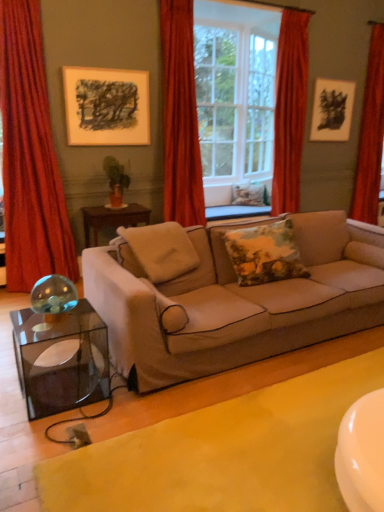
What are the coordinates of `free spot above matte black picture frame at upper left, which is the second picture frame from back to front (from a real-world perspective)` in the screenshot? It's located at (107, 70).